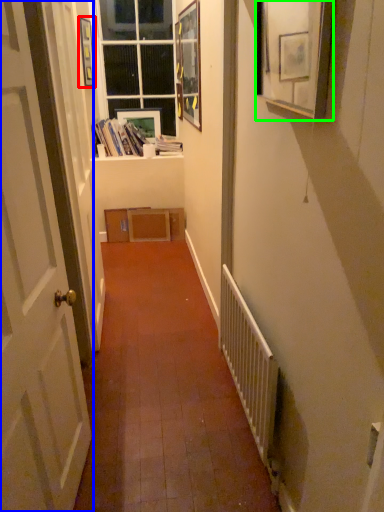
Question: Which object is the farthest from picture frame (highlighted by a red box)? Choose among these: door (highlighted by a blue box) or picture frame (highlighted by a green box).

Choices:
 (A) door
 (B) picture frame

Answer: (B)